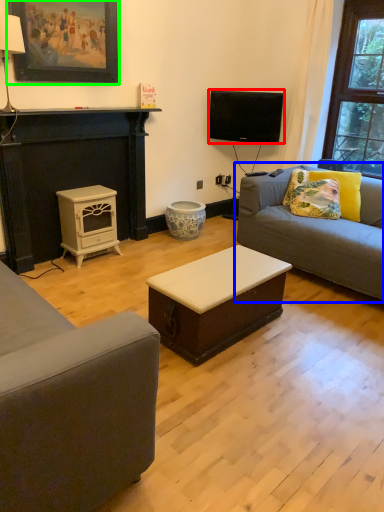
Question: Which object is the closest to the television (highlighted by a red box)? Choose among these: studio couch (highlighted by a blue box) or picture frame (highlighted by a green box).

Choices:
 (A) studio couch
 (B) picture frame

Answer: (A)